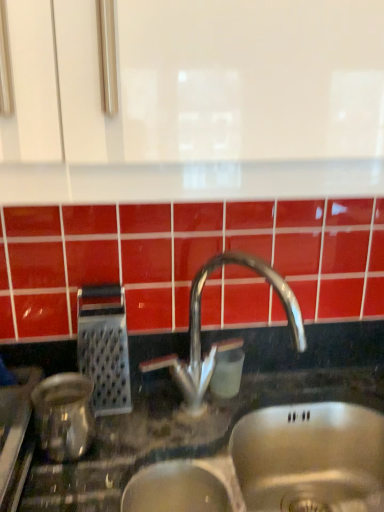
Find the location of a particular element. metallic grater at left, the 1th appliance viewed from the back is located at coordinates (104, 348).

This screenshot has height=512, width=384. Find the location of `shiny metallic kettle at left, positioned as the 2th appliance in back-to-front order`. shiny metallic kettle at left, positioned as the 2th appliance in back-to-front order is located at coordinates (64, 415).

Measure the distance from polished metallic faucet at center to shiny metallic kettle at left, the 1th appliance positioned from the front.

The distance of polished metallic faucet at center from shiny metallic kettle at left, the 1th appliance positioned from the front, is 10.32 inches.

From the image's perspective, would you say polished metallic faucet at center is positioned over shiny metallic kettle at left, the 1th appliance positioned from the front?

Correct, polished metallic faucet at center appears higher than shiny metallic kettle at left, the 1th appliance positioned from the front, in the image.

Which object is closer to the camera taking this photo, polished metallic faucet at center or shiny metallic kettle at left, positioned as the 2th appliance in back-to-front order?

Positioned in front is shiny metallic kettle at left, positioned as the 2th appliance in back-to-front order.

Can you confirm if polished metallic faucet at center is smaller than shiny metallic kettle at left, the 1th appliance positioned from the front?

Actually, polished metallic faucet at center might be larger than shiny metallic kettle at left, the 1th appliance positioned from the front.

Considering the sizes of polished metallic faucet at center and metallic grater at left, which ranks as the second appliance in front-to-back order, in the image, is polished metallic faucet at center taller or shorter than metallic grater at left, which ranks as the second appliance in front-to-back order,?

Clearly, polished metallic faucet at center is taller compared to metallic grater at left, which ranks as the second appliance in front-to-back order.

Considering the sizes of polished metallic faucet at center and metallic grater at left, the 1th appliance viewed from the back, in the image, is polished metallic faucet at center wider or thinner than metallic grater at left, the 1th appliance viewed from the back,?

Clearly, polished metallic faucet at center has more width compared to metallic grater at left, the 1th appliance viewed from the back.

From a real-world perspective, which is physically below, polished metallic faucet at center or metallic grater at left, the 1th appliance viewed from the back?

metallic grater at left, the 1th appliance viewed from the back, is physically lower.

Choose the correct answer: Is polished metallic faucet at center inside metallic grater at left, which ranks as the second appliance in front-to-back order, or outside it?

polished metallic faucet at center is not enclosed by metallic grater at left, which ranks as the second appliance in front-to-back order.

From a real-world perspective, is shiny metallic kettle at left, the 1th appliance positioned from the front, physically located above or below metallic grater at left, which ranks as the second appliance in front-to-back order?

shiny metallic kettle at left, the 1th appliance positioned from the front, is situated lower than metallic grater at left, which ranks as the second appliance in front-to-back order, in the real world.

Considering the points (81, 383) and (100, 413), which point is in front, point (81, 383) or point (100, 413)?

Point (81, 383)

From the image's perspective, is shiny metallic kettle at left, the 1th appliance positioned from the front, positioned above or below metallic grater at left, which ranks as the second appliance in front-to-back order?

From the image's perspective, shiny metallic kettle at left, the 1th appliance positioned from the front, appears below metallic grater at left, which ranks as the second appliance in front-to-back order.

Does shiny metallic kettle at left, the 1th appliance positioned from the front, come behind metallic grater at left, which ranks as the second appliance in front-to-back order?

No, shiny metallic kettle at left, the 1th appliance positioned from the front, is closer to the camera.

From the image's perspective, is metallic grater at left, the 1th appliance viewed from the back, above or below polished metallic faucet at center?

Based on their image positions, metallic grater at left, the 1th appliance viewed from the back, is located beneath polished metallic faucet at center.

From a real-world perspective, is metallic grater at left, the 1th appliance viewed from the back, on top of polished metallic faucet at center?

No, from a real-world perspective, metallic grater at left, the 1th appliance viewed from the back, is not above polished metallic faucet at center.

Based on their sizes in the image, would you say metallic grater at left, the 1th appliance viewed from the back, is bigger or smaller than polished metallic faucet at center?

In the image, metallic grater at left, the 1th appliance viewed from the back, appears to be smaller than polished metallic faucet at center.

Is metallic grater at left, which ranks as the second appliance in front-to-back order, aimed at shiny metallic kettle at left, positioned as the 2th appliance in back-to-front order?

Yes, metallic grater at left, which ranks as the second appliance in front-to-back order, is facing shiny metallic kettle at left, positioned as the 2th appliance in back-to-front order.

Consider the image. From the image's perspective, which one is positioned higher, metallic grater at left, which ranks as the second appliance in front-to-back order, or shiny metallic kettle at left, the 1th appliance positioned from the front?

metallic grater at left, which ranks as the second appliance in front-to-back order, from the image's perspective.

Is metallic grater at left, the 1th appliance viewed from the back, positioned before shiny metallic kettle at left, positioned as the 2th appliance in back-to-front order?

No, metallic grater at left, the 1th appliance viewed from the back, is behind shiny metallic kettle at left, positioned as the 2th appliance in back-to-front order.

Is metallic grater at left, which ranks as the second appliance in front-to-back order, situated inside shiny metallic kettle at left, the 1th appliance positioned from the front, or outside?

metallic grater at left, which ranks as the second appliance in front-to-back order, is spatially situated outside shiny metallic kettle at left, the 1th appliance positioned from the front.

Is shiny metallic kettle at left, positioned as the 2th appliance in back-to-front order, positioned far away from polished metallic faucet at center?

That's not correct — shiny metallic kettle at left, positioned as the 2th appliance in back-to-front order, is a little close to polished metallic faucet at center.

Does shiny metallic kettle at left, the 1th appliance positioned from the front, appear on the right side of polished metallic faucet at center?

In fact, shiny metallic kettle at left, the 1th appliance positioned from the front, is to the left of polished metallic faucet at center.

Is shiny metallic kettle at left, the 1th appliance positioned from the front, positioned in front of polished metallic faucet at center?

Yes, shiny metallic kettle at left, the 1th appliance positioned from the front, is closer to the camera.

Find the location of `tap that appears above the shiny metallic kettle at left, positioned as the 2th appliance in back-to-front order (from a real-world perspective)`. tap that appears above the shiny metallic kettle at left, positioned as the 2th appliance in back-to-front order (from a real-world perspective) is located at coordinates coord(223,341).

Find the location of a particular element. tap on the right of metallic grater at left, the 1th appliance viewed from the back is located at coordinates (223, 341).

Which object lies nearer to the anchor point polished metallic faucet at center, shiny metallic kettle at left, positioned as the 2th appliance in back-to-front order, or metallic grater at left, which ranks as the second appliance in front-to-back order?

metallic grater at left, which ranks as the second appliance in front-to-back order, lies closer to polished metallic faucet at center than the other object.

From the image, which object appears to be nearer to metallic grater at left, the 1th appliance viewed from the back, polished metallic faucet at center or shiny metallic kettle at left, positioned as the 2th appliance in back-to-front order?

shiny metallic kettle at left, positioned as the 2th appliance in back-to-front order, is closer to metallic grater at left, the 1th appliance viewed from the back.

From the image, which object appears to be farther from metallic grater at left, the 1th appliance viewed from the back, shiny metallic kettle at left, positioned as the 2th appliance in back-to-front order, or polished metallic faucet at center?

Among the two, polished metallic faucet at center is located further to metallic grater at left, the 1th appliance viewed from the back.

From the image, which object appears to be nearer to shiny metallic kettle at left, positioned as the 2th appliance in back-to-front order, polished metallic faucet at center or metallic grater at left, the 1th appliance viewed from the back?

metallic grater at left, the 1th appliance viewed from the back, is closer to shiny metallic kettle at left, positioned as the 2th appliance in back-to-front order.

From the image, which object appears to be farther from polished metallic faucet at center, metallic grater at left, the 1th appliance viewed from the back, or shiny metallic kettle at left, positioned as the 2th appliance in back-to-front order?

The object further to polished metallic faucet at center is shiny metallic kettle at left, positioned as the 2th appliance in back-to-front order.

Which object lies nearer to the anchor point shiny metallic kettle at left, positioned as the 2th appliance in back-to-front order, metallic grater at left, which ranks as the second appliance in front-to-back order, or polished metallic faucet at center?

metallic grater at left, which ranks as the second appliance in front-to-back order.

Find the location of a particular element. appliance situated between shiny metallic kettle at left, the 1th appliance positioned from the front, and polished metallic faucet at center from left to right is located at coordinates [104, 348].